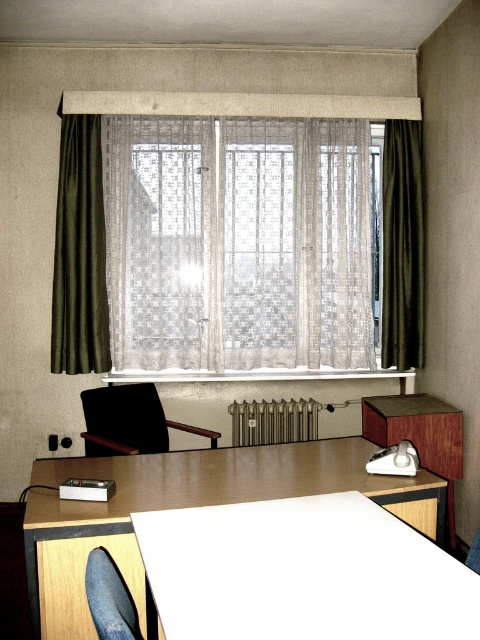
Does white lace curtain at center have a greater height compared to matte black swivel chair at lower left?

Yes.

Which is in front, point (262, 276) or point (101, 628)?

Point (101, 628)

Does point (317, 216) lie in front of point (106, 605)?

No, (317, 216) is behind (106, 605).

In order to click on white lace curtain at center in this screenshot , I will do `click(238, 243)`.

Which is below, dark olive green fabric curtain at left or silver metallic radiator at center?

silver metallic radiator at center

Is dark olive green fabric curtain at left thinner than silver metallic radiator at center?

Yes, dark olive green fabric curtain at left is thinner than silver metallic radiator at center.

The height and width of the screenshot is (640, 480). What do you see at coordinates (80, 252) in the screenshot? I see `dark olive green fabric curtain at left` at bounding box center [80, 252].

Locate an element on the screen. This screenshot has height=640, width=480. dark olive green fabric curtain at left is located at coordinates (80, 252).

Can you confirm if black wood armchair at left is positioned to the left of matte black swivel chair at lower left?

Correct, you'll find black wood armchair at left to the left of matte black swivel chair at lower left.

Does point (112, 429) lie behind point (91, 556)?

That is True.

What do you see at coordinates (129, 420) in the screenshot?
I see `black wood armchair at left` at bounding box center [129, 420].

At what (x,y) coordinates should I click in order to perform the action: click on black wood armchair at left. Please return your answer as a coordinate pair (x, y). Looking at the image, I should click on (129, 420).